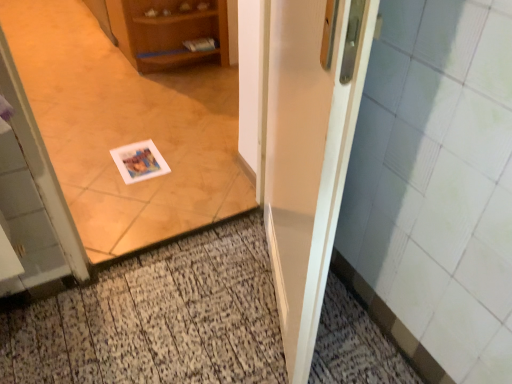
In order to click on free region on the left part of wooden cabinet at upper left in this screenshot , I will do `click(60, 36)`.